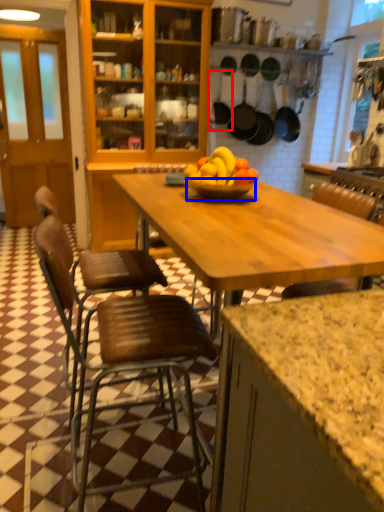
Question: Which of the following is the farthest to the observer, frying pan (highlighted by a red box) or glass bowl (highlighted by a blue box)?

Choices:
 (A) frying pan
 (B) glass bowl

Answer: (A)